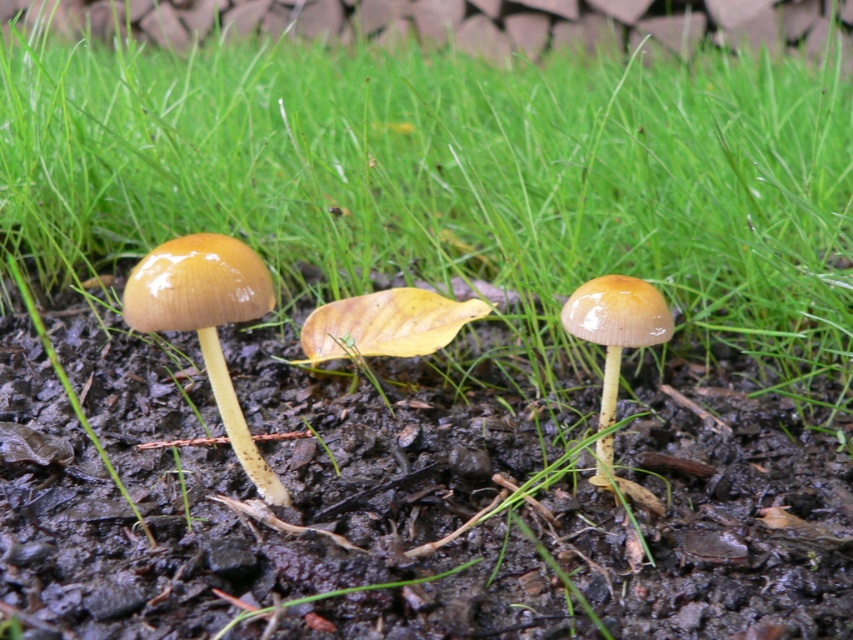
You are a gardener holding a watering can and need to water the glossy yellow mushroom at left. If your watering can has a range of 1 meter, can you reach it without moving closer?

The glossy yellow mushroom at left is 1.16 meters away from the viewer, which is beyond the watering can range of 1 meter. Therefore, you cannot reach it without moving closer.